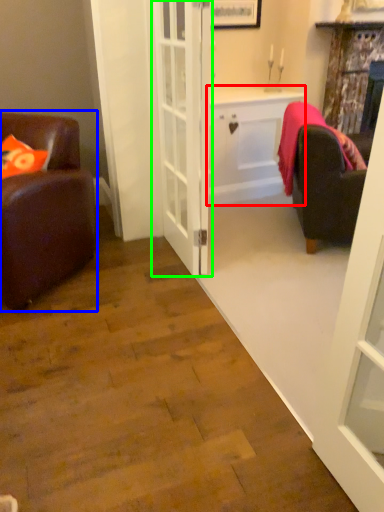
Question: Considering the real-world distances, which object is closest to cabinetry (highlighted by a red box)? chair (highlighted by a blue box) or door (highlighted by a green box).

Choices:
 (A) chair
 (B) door

Answer: (B)